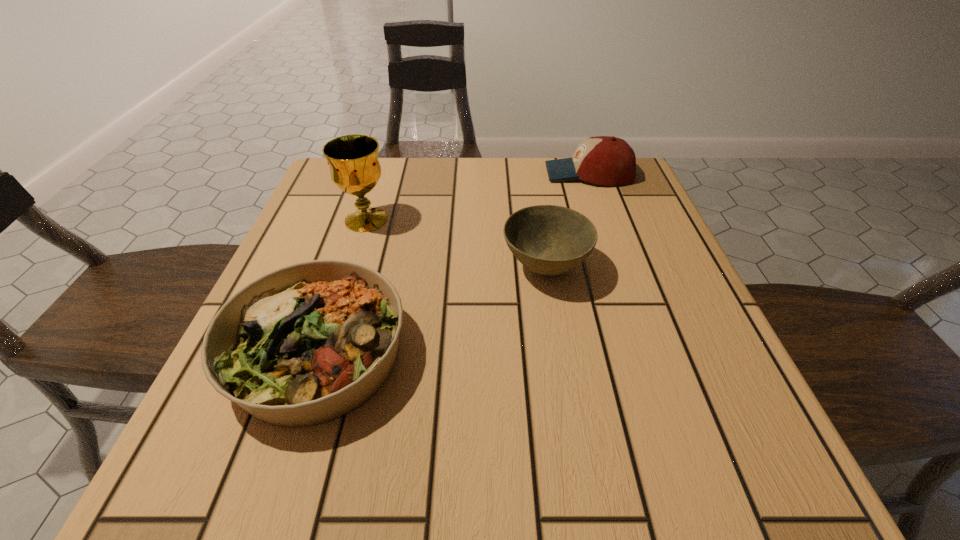
Identify the location of vacant space positioned 0.240m on the back of the salad plate. (365, 215).

Where is `chalice that is at the far edge`? The image size is (960, 540). chalice that is at the far edge is located at coordinates (353, 160).

Image resolution: width=960 pixels, height=540 pixels. In order to click on baseball cap present at the far edge in this screenshot , I will do `click(604, 160)`.

Identify the location of object that is at the near edge. (308, 343).

This screenshot has height=540, width=960. I want to click on chalice at the left edge, so click(x=353, y=160).

I want to click on salad plate at the left edge, so [x=308, y=343].

You are a GUI agent. You are given a task and a screenshot of the screen. Output one action in this format:
    pyautogui.click(x=<x>, y=<y>)
    Task: Click on the object that is positioned at the right edge
    This screenshot has height=540, width=960.
    Given the screenshot: What is the action you would take?
    pyautogui.click(x=604, y=160)

Identify the location of object positioned at the far left corner. This screenshot has height=540, width=960. (353, 160).

You are a GUI agent. You are given a task and a screenshot of the screen. Output one action in this format:
    pyautogui.click(x=<x>, y=<y>)
    Task: Click on the object present at the near left corner
    The image size is (960, 540).
    Given the screenshot: What is the action you would take?
    pyautogui.click(x=308, y=343)

Where is `object that is at the far right corner`? This screenshot has width=960, height=540. object that is at the far right corner is located at coordinates (604, 160).